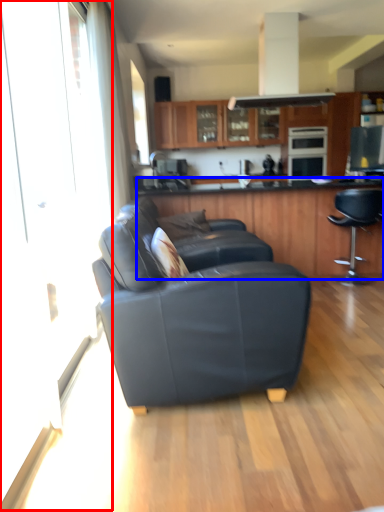
Question: Among these objects, which one is nearest to the camera, screen door (highlighted by a red box) or cabinetry (highlighted by a blue box)?

Choices:
 (A) screen door
 (B) cabinetry

Answer: (A)